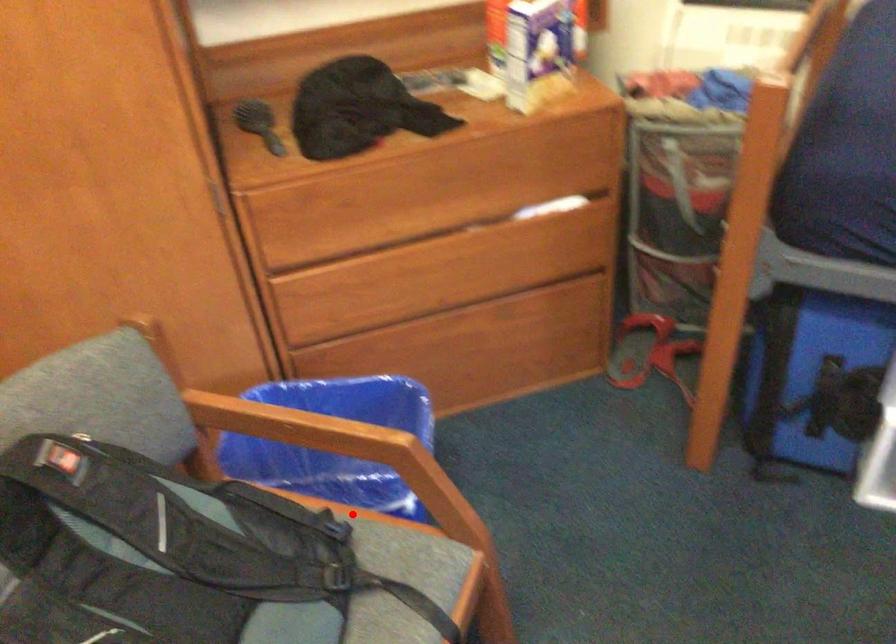
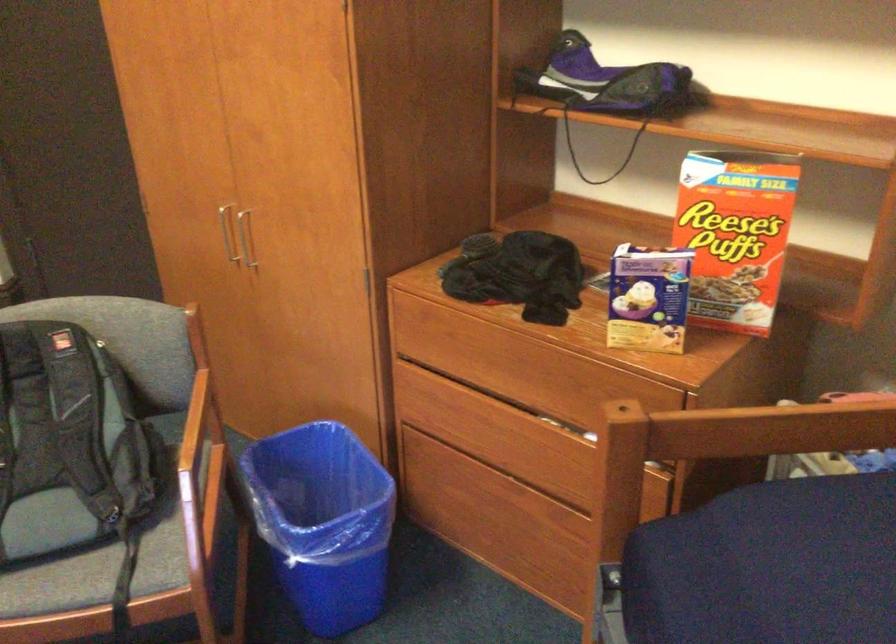
Question: I am providing you with two images of the same scene from different viewpoints. A red point is marked on the first image. At the location where the point appears in image 1, is it still visible in image 2?

Choices:
 (A) Yes
 (B) No

Answer: (B)